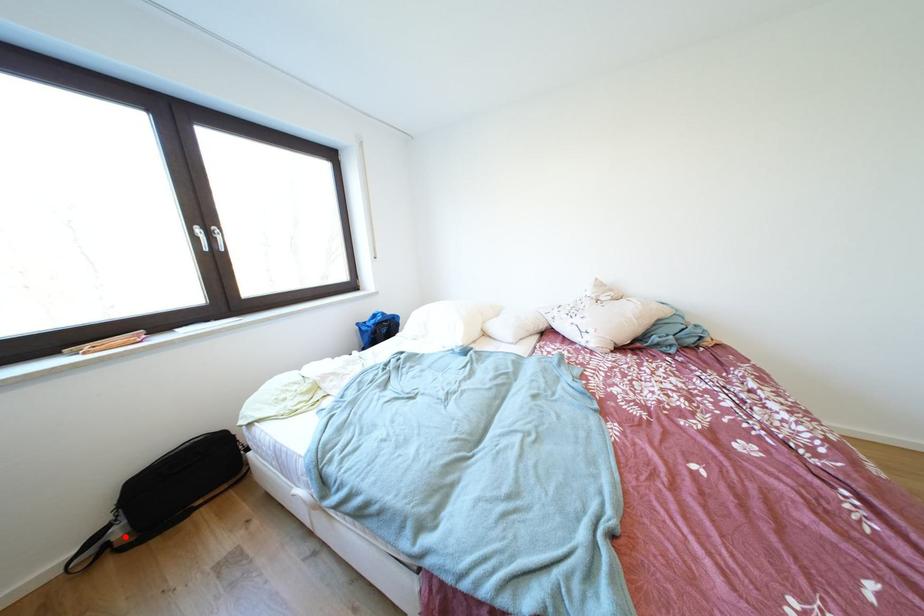
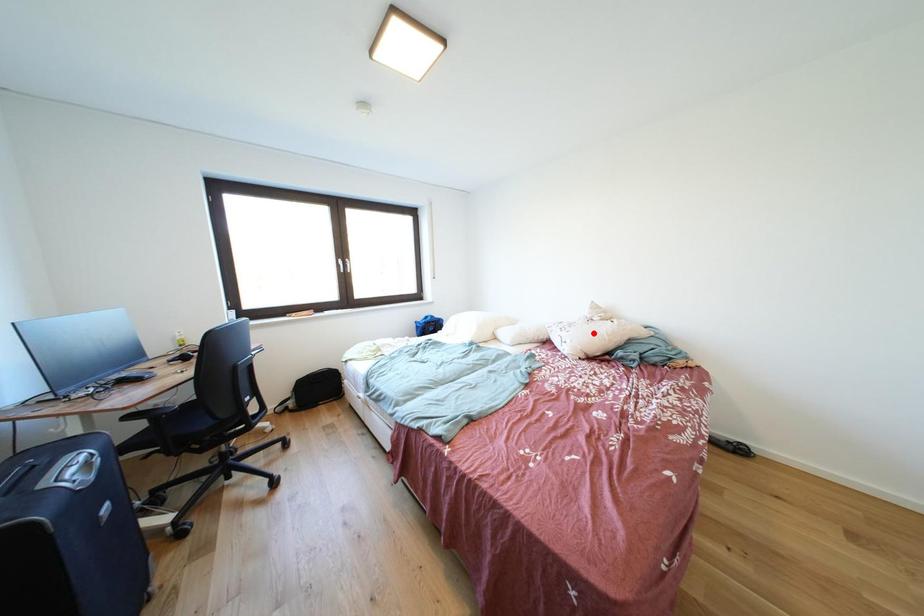
I am providing you with two images of the same scene from different viewpoints. A red point is marked on the first image and another point is marked on the second image. Do the highlighted points in image1 and image2 indicate the same real-world spot?

No